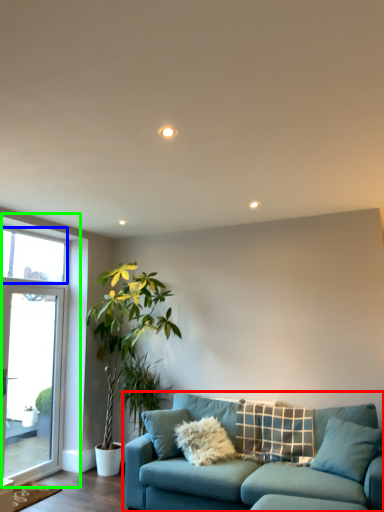
Question: Which is nearer to the studio couch (highlighted by a red box)? window screen (highlighted by a blue box) or window (highlighted by a green box).

Choices:
 (A) window screen
 (B) window

Answer: (B)